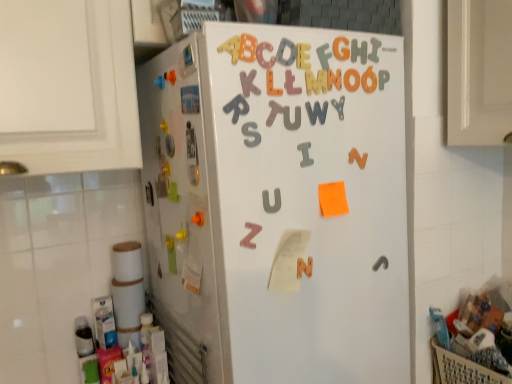
Question: Does gray matte letter w at upper center, which is the 4th letter in right-to-left order, have a greater width compared to matte plastic letter at upper center, the third letter from the left?

Choices:
 (A) no
 (B) yes

Answer: (B)

Question: Does gray matte letter w at upper center, the 6th letter when ordered from left to right, turn towards matte plastic letter at upper center, the seventh letter in the right-to-left sequence?

Choices:
 (A) yes
 (B) no

Answer: (B)

Question: From the image's perspective, is gray matte letter w at upper center, the 6th letter when ordered from left to right, under matte plastic letter at upper center, the third letter from the left?

Choices:
 (A) yes
 (B) no

Answer: (A)

Question: Can you confirm if gray matte letter w at upper center, which is the 4th letter in right-to-left order, is taller than matte plastic letter at upper center, the third letter from the left?

Choices:
 (A) no
 (B) yes

Answer: (B)

Question: Is gray matte letter w at upper center, the 6th letter when ordered from left to right, far from matte plastic letter at upper center, the third letter from the left?

Choices:
 (A) no
 (B) yes

Answer: (A)

Question: Considering the relative sizes of gray matte letter w at upper center, which is the 4th letter in right-to-left order, and matte plastic letter at upper center, the third letter from the left, in the image provided, is gray matte letter w at upper center, which is the 4th letter in right-to-left order, thinner than matte plastic letter at upper center, the third letter from the left,?

Choices:
 (A) yes
 (B) no

Answer: (B)

Question: Considering the relative sizes of pink matte letter z at center and gray matte letter w at upper center, which is the 4th letter in right-to-left order, in the image provided, is pink matte letter z at center smaller than gray matte letter w at upper center, which is the 4th letter in right-to-left order,?

Choices:
 (A) yes
 (B) no

Answer: (B)

Question: From a real-world perspective, is pink matte letter z at center on gray matte letter w at upper center, which is the 4th letter in right-to-left order?

Choices:
 (A) no
 (B) yes

Answer: (A)

Question: Can we say pink matte letter z at center lies outside gray matte letter w at upper center, which is the 4th letter in right-to-left order?

Choices:
 (A) yes
 (B) no

Answer: (A)

Question: Is pink matte letter z at center touching gray matte letter w at upper center, which is the 4th letter in right-to-left order?

Choices:
 (A) yes
 (B) no

Answer: (B)

Question: Can you confirm if pink matte letter z at center is thinner than gray matte letter w at upper center, the 6th letter when ordered from left to right?

Choices:
 (A) no
 (B) yes

Answer: (A)

Question: Considering the relative sizes of pink matte letter z at center and gray matte letter w at upper center, which is the 4th letter in right-to-left order, in the image provided, is pink matte letter z at center bigger than gray matte letter w at upper center, which is the 4th letter in right-to-left order,?

Choices:
 (A) no
 (B) yes

Answer: (B)

Question: From a real-world perspective, does pink matte letter z at center stand above matte plastic letter t at center, which is the ninth letter from right to left?

Choices:
 (A) yes
 (B) no

Answer: (B)